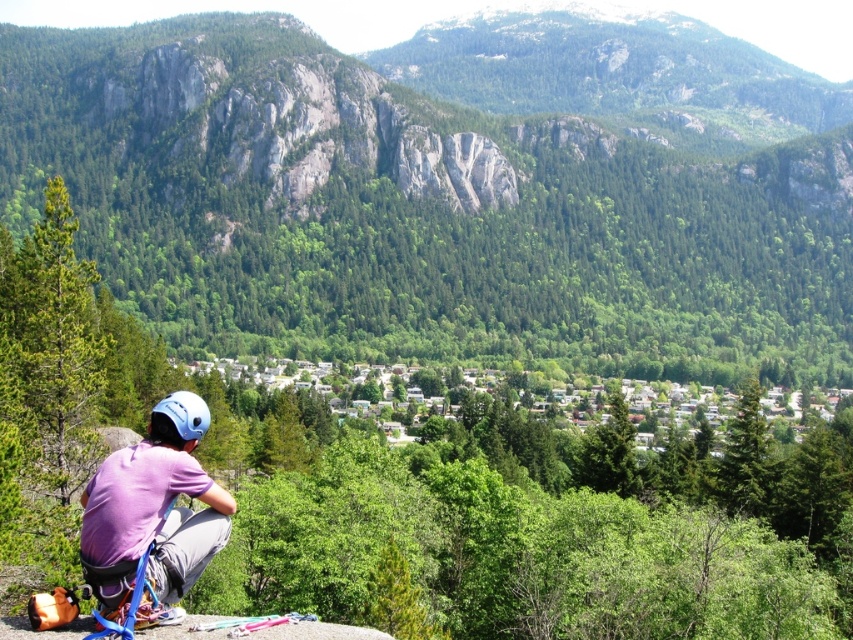
Question: Is rocky cliff at center closer to the viewer compared to blue matte helmet at lower left?

Choices:
 (A) yes
 (B) no

Answer: (B)

Question: Does purple fabric helmet at lower left have a larger size compared to blue matte helmet at lower left?

Choices:
 (A) no
 (B) yes

Answer: (A)

Question: Among these objects, which one is farthest from the camera?

Choices:
 (A) purple fabric helmet at lower left
 (B) rocky cliff at center
 (C) blue matte helmet at lower left

Answer: (B)

Question: Is rocky cliff at center below blue matte helmet at lower left?

Choices:
 (A) yes
 (B) no

Answer: (B)

Question: Which object is the closest to the purple fabric helmet at lower left?

Choices:
 (A) blue matte helmet at lower left
 (B) rocky cliff at center

Answer: (A)

Question: Which point appears closest to the camera in this image?

Choices:
 (A) (198, 253)
 (B) (160, 420)
 (C) (213, 532)

Answer: (B)